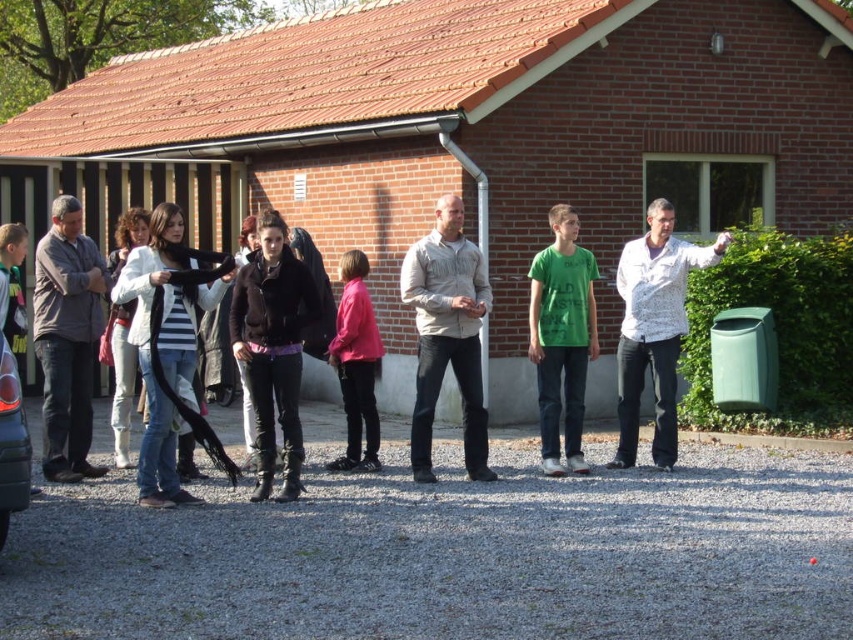
Question: Which point is farther to the camera?

Choices:
 (A) black glossy car at left
 (B) striped fabric jacket at center
 (C) dark gray textured jacket at left
 (D) green matte t-shirt at center

Answer: (D)

Question: Considering the real-world distances, which object is farthest from the white textured shirt at right?

Choices:
 (A) black glossy car at left
 (B) green matte t-shirt at center

Answer: (A)

Question: Does beige cotton shirt at center appear under green matte t-shirt at center?

Choices:
 (A) yes
 (B) no

Answer: (A)

Question: Does striped fabric jacket at center have a smaller size compared to black glossy car at left?

Choices:
 (A) yes
 (B) no

Answer: (B)

Question: Is striped fabric jacket at center positioned at the back of black leather jacket at center?

Choices:
 (A) yes
 (B) no

Answer: (B)

Question: Which object appears closest to the camera in this image?

Choices:
 (A) black leather jacket at center
 (B) dark gray textured jacket at left
 (C) black glossy car at left
 (D) green matte t-shirt at center

Answer: (C)